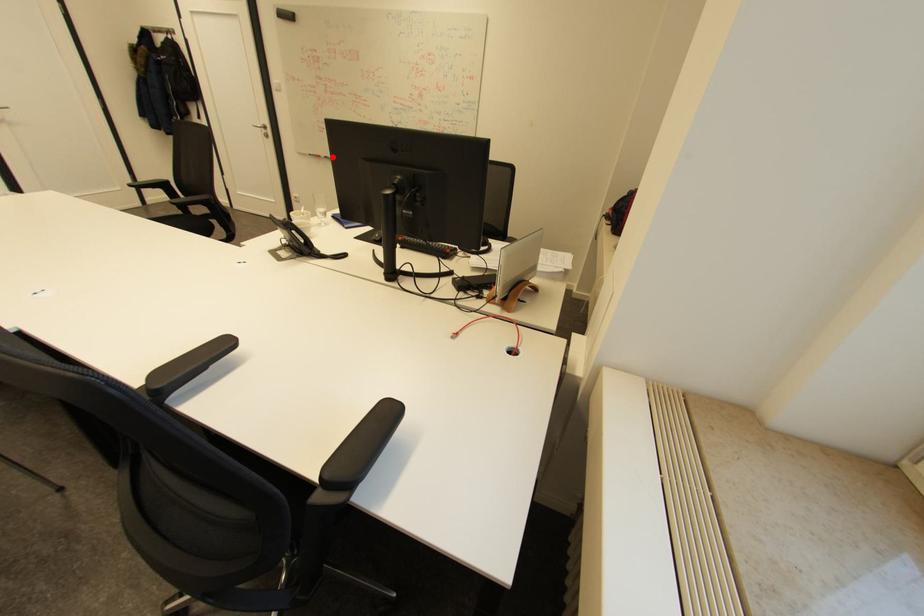
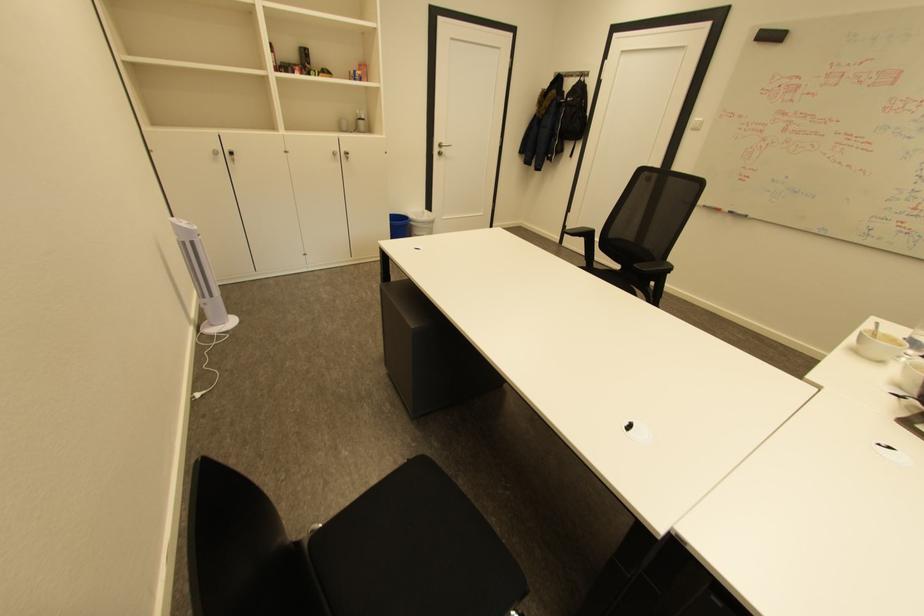
Where in the second image is the point corresponding to the highlighted location from the first image?

(737, 212)